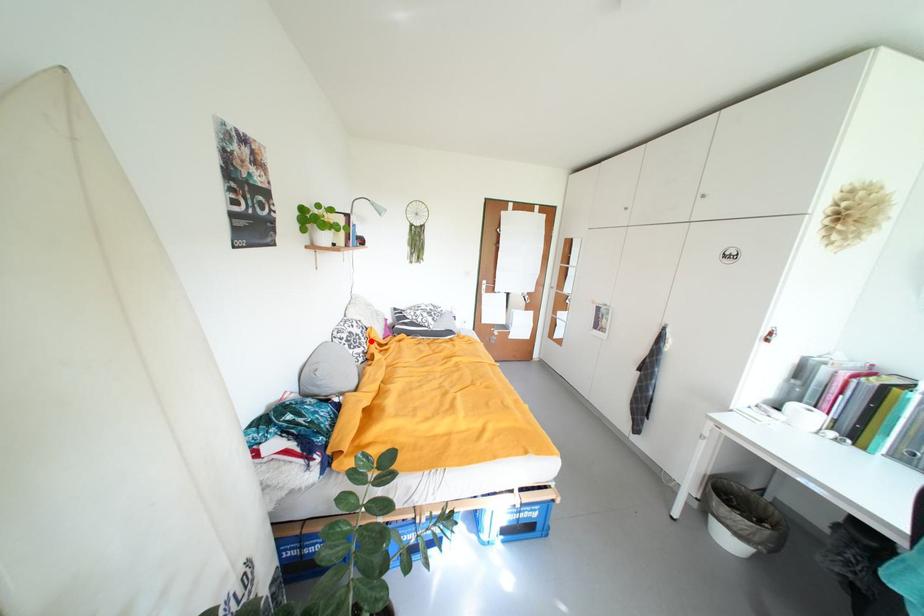
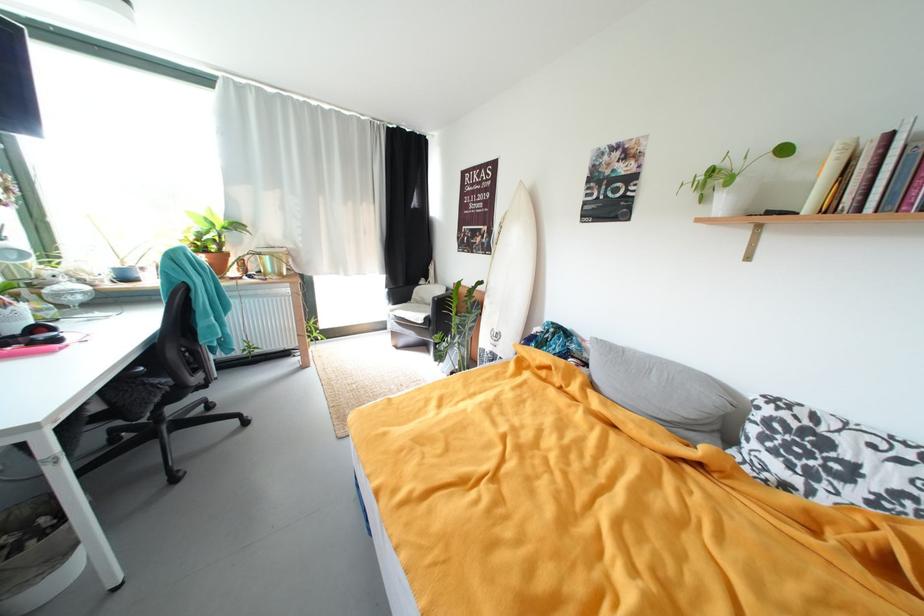
In the second image, find the point that corresponds to the highlighted location in the first image.

(861, 493)